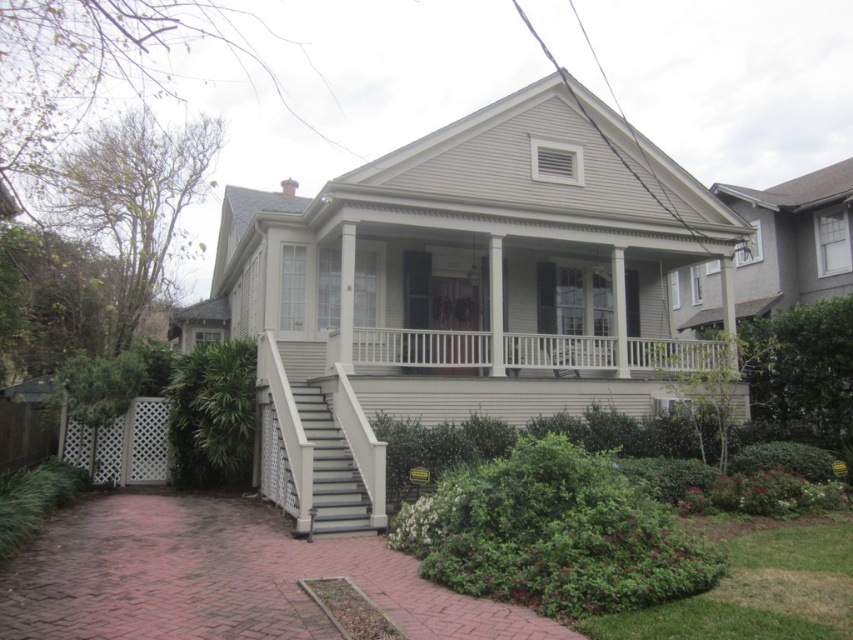
Question: Can you confirm if smooth gray porch at center is positioned to the left of gray painted wood stairs at lower left?

Choices:
 (A) yes
 (B) no

Answer: (B)

Question: Is smooth gray porch at center in front of gray painted wood stairs at lower left?

Choices:
 (A) yes
 (B) no

Answer: (A)

Question: Considering the relative positions of smooth gray porch at center and gray painted wood stairs at lower left in the image provided, where is smooth gray porch at center located with respect to gray painted wood stairs at lower left?

Choices:
 (A) left
 (B) right

Answer: (B)

Question: Which of the following is the farthest from the observer?

Choices:
 (A) (344, 458)
 (B) (384, 397)

Answer: (B)